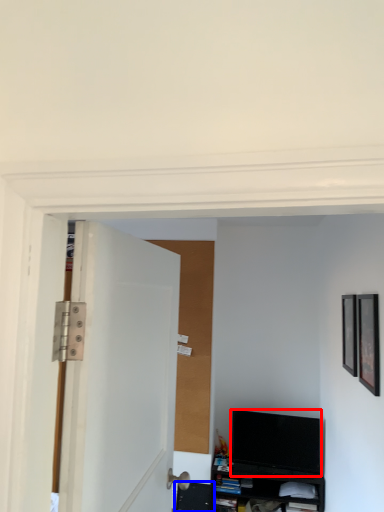
Question: Which point is closer to the camera, television (highlighted by a red box) or shelf (highlighted by a blue box)?

Choices:
 (A) television
 (B) shelf

Answer: (A)